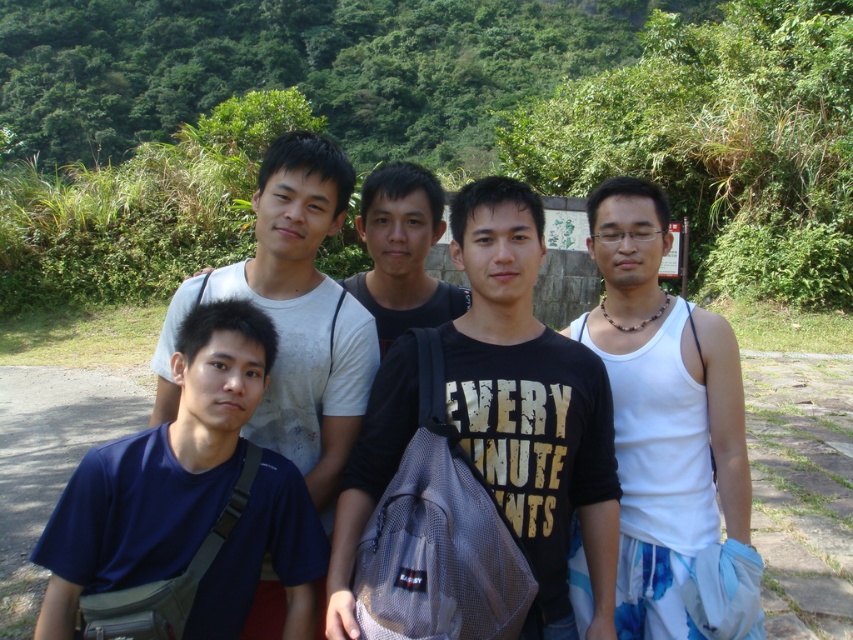
Is black mesh backpack at center shorter than black matte shirt at center?

Incorrect, black mesh backpack at center's height does not fall short of black matte shirt at center's.

The image size is (853, 640). What are the coordinates of `black mesh backpack at center` in the screenshot? It's located at (531, 404).

Who is more distant from viewer, (x=521, y=214) or (x=428, y=282)?

Point (x=428, y=282)

At what (x,y) coordinates should I click in order to perform the action: click on black mesh backpack at center. Please return your answer as a coordinate pair (x, y). Looking at the image, I should click on (531, 404).

Between point (235, 364) and point (434, 209), which one is positioned behind?

The point (434, 209) is behind.

Is dark blue fabric shirt at lower left bigger than black matte shirt at center?

Yes.

Between point (142, 509) and point (399, 237), which one is positioned behind?

The point (399, 237) is more distant.

This screenshot has height=640, width=853. Find the location of `dark blue fabric shirt at lower left`. dark blue fabric shirt at lower left is located at coordinates [189, 496].

Can you confirm if black mesh backpack at center is thinner than white tank top at right?

No.

This screenshot has height=640, width=853. Describe the element at coordinates (531, 404) in the screenshot. I see `black mesh backpack at center` at that location.

Find the location of a particular element. Image resolution: width=853 pixels, height=640 pixels. black mesh backpack at center is located at coordinates (531, 404).